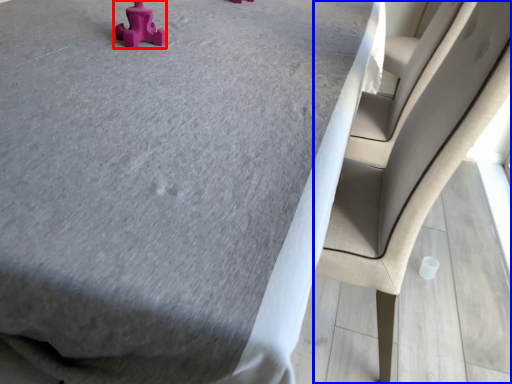
Question: Which of the following is the farthest to the observer, toy (highlighted by a red box) or chair (highlighted by a blue box)?

Choices:
 (A) toy
 (B) chair

Answer: (A)